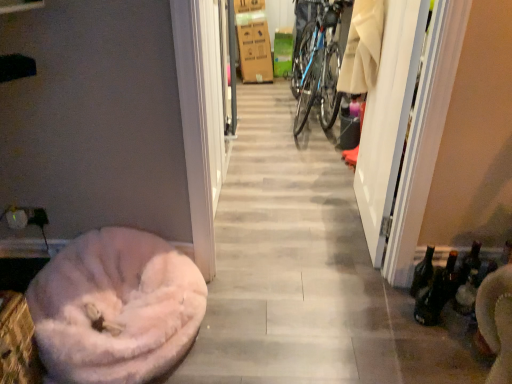
Question: Considering their positions, is fuzzy pink dog bed at lower left located in front of or behind white glossy screen door at right?

Choices:
 (A) behind
 (B) front

Answer: (B)

Question: Is fuzzy pink dog bed at lower left taller or shorter than white glossy screen door at right?

Choices:
 (A) tall
 (B) short

Answer: (B)

Question: Which object is the closest to the blue metallic bicycle at center?

Choices:
 (A) fuzzy pink dog bed at lower left
 (B) blue metallic bicycle tire at center-right
 (C) white glossy screen door at right
 (D) brown cardboard box at upper center

Answer: (B)

Question: Estimate the real-world distances between objects in this image. Which object is farther from the fuzzy pink dog bed at lower left?

Choices:
 (A) brown cardboard box at upper center
 (B) white glossy screen door at right
 (C) blue metallic bicycle at center
 (D) blue metallic bicycle tire at center-right

Answer: (A)